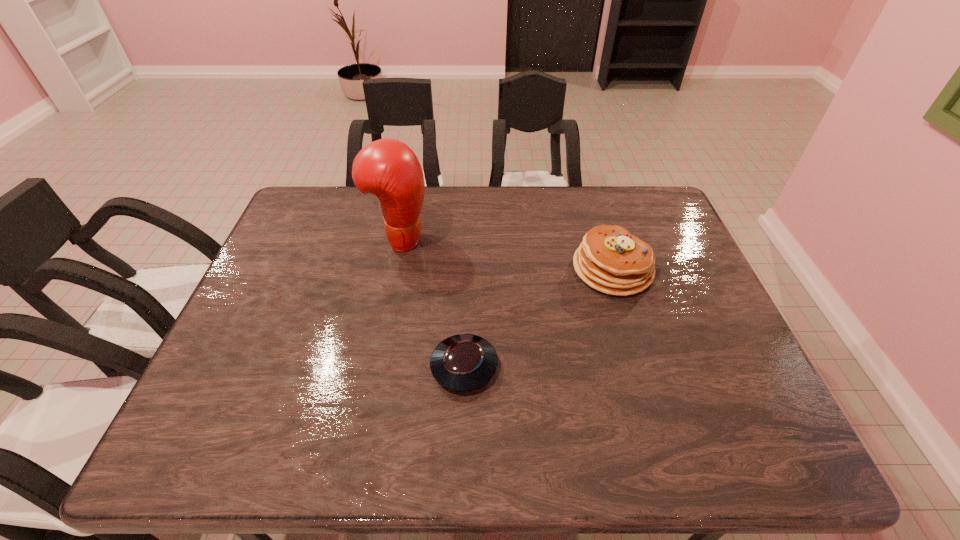
Identify the location of object located at the right edge. This screenshot has height=540, width=960. (611, 260).

Where is `free region at the far edge of the desktop`? free region at the far edge of the desktop is located at coordinates (516, 211).

You are a GUI agent. You are given a task and a screenshot of the screen. Output one action in this format:
    pyautogui.click(x=<x>, y=<y>)
    Task: Click on the free space at the near edge of the desktop
    
    Given the screenshot: What is the action you would take?
    click(680, 440)

The width and height of the screenshot is (960, 540). What are the coordinates of `blank area at the left edge` in the screenshot? It's located at (326, 236).

Locate an element on the screen. Image resolution: width=960 pixels, height=540 pixels. vacant space at the right edge is located at coordinates (699, 294).

Find the location of a particular element. This screenshot has width=960, height=540. free space at the far left corner of the desktop is located at coordinates (343, 186).

Identify the location of free space between the saucer and the second shortest object. This screenshot has width=960, height=540. (539, 318).

Identify the location of empty space between the nearest object and the pancake. (539, 318).

Locate an element on the screen. The height and width of the screenshot is (540, 960). free space between the tallest object and the second shortest object is located at coordinates (506, 254).

At what (x,y) coordinates should I click in order to perform the action: click on vacant space that is in between the shortest object and the pancake. Please return your answer as a coordinate pair (x, y). Looking at the image, I should click on (539, 318).